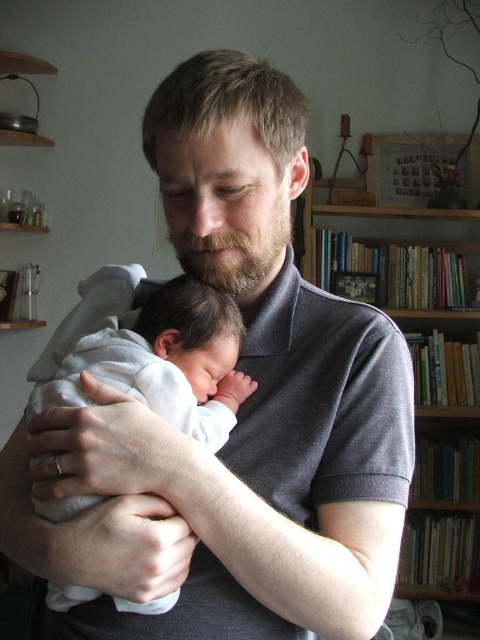
Consider the image. Can you confirm if wooden bookshelf at upper right is shorter than white soft baby at center?

Incorrect, wooden bookshelf at upper right's height does not fall short of white soft baby at center's.

Does point (440, 358) lie in front of point (115, 330)?

No, it is not.

Between point (439, 525) and point (227, 400), which one is positioned behind?

The point (439, 525) is more distant.

The width and height of the screenshot is (480, 640). In order to click on wooden bookshelf at upper right in this screenshot , I will do `click(424, 392)`.

Between white soft baby at center and brown fuzzy beard at center, which one is positioned higher?

brown fuzzy beard at center

From the picture: Is white soft baby at center wider than brown fuzzy beard at center?

Correct, the width of white soft baby at center exceeds that of brown fuzzy beard at center.

Does point (204, 376) come behind point (170, 212)?

Yes, it is behind point (170, 212).

Identify the location of white soft baby at center. (165, 362).

Does wooden bookshelf at upper right appear under brown fuzzy beard at center?

Yes.

Can you confirm if wooden bookshelf at upper right is positioned to the right of brown fuzzy beard at center?

Yes, wooden bookshelf at upper right is to the right of brown fuzzy beard at center.

Between point (428, 356) and point (285, 216), which one is positioned in front?

Point (285, 216) is in front.

Find the location of a particular element. wooden bookshelf at upper right is located at coordinates (424, 392).